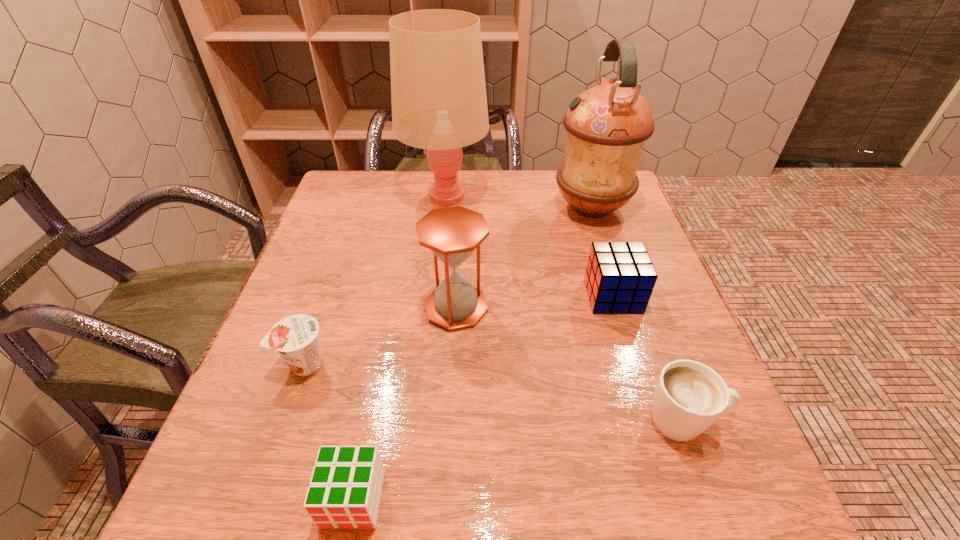
I want to click on vacant space that satisfies the following two spatial constraints: 1. on the back side of the third nearest object; 2. on the left side of the hourglass, so coord(324,307).

This screenshot has height=540, width=960. In order to click on free space that satisfies the following two spatial constraints: 1. on the back side of the leftmost object; 2. on the right side of the farther cube in this screenshot , I will do `click(328, 296)`.